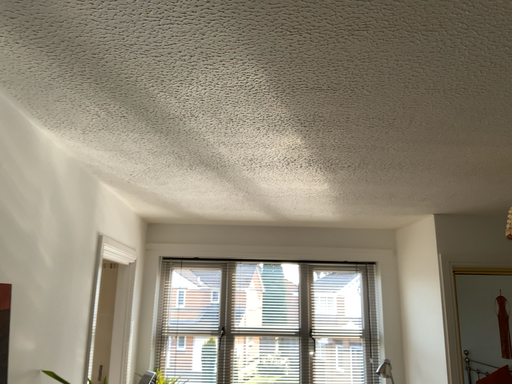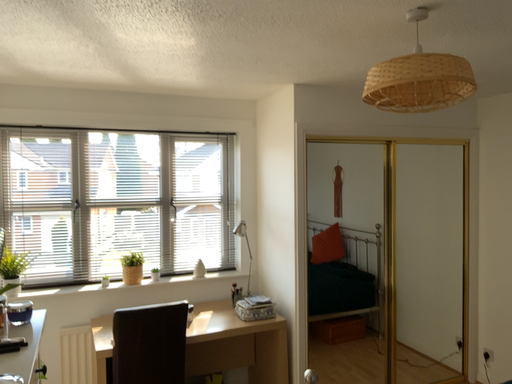
Question: Which way did the camera rotate in the video?

Choices:
 (A) rotated left
 (B) rotated right

Answer: (B)